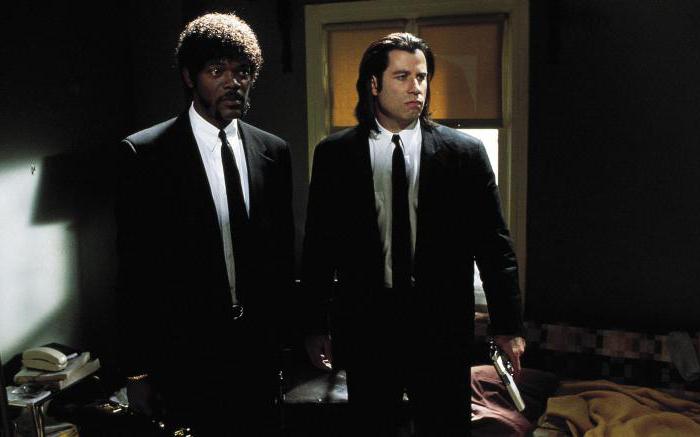
Identify the location of window. The image size is (700, 437). (514, 96).